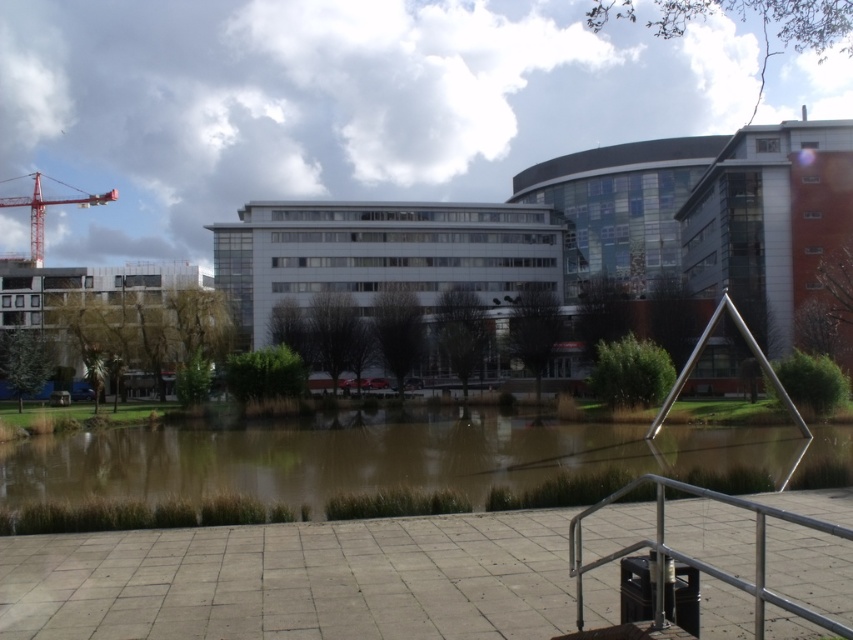
Question: Which point is farther from the camera taking this photo?

Choices:
 (A) (38, 266)
 (B) (204, 490)

Answer: (A)

Question: Does brown muddy water at center have a larger size compared to red metal crane at upper left?

Choices:
 (A) yes
 (B) no

Answer: (B)

Question: Which object is farther from the camera taking this photo?

Choices:
 (A) brown muddy water at center
 (B) silver metallic rail at lower right

Answer: (A)

Question: Can you confirm if brown muddy water at center is positioned to the right of red metal crane at upper left?

Choices:
 (A) no
 (B) yes

Answer: (B)

Question: Can you confirm if silver metallic rail at lower right is bigger than red metal crane at upper left?

Choices:
 (A) no
 (B) yes

Answer: (A)

Question: Which of the following is the closest to the observer?

Choices:
 (A) (524, 460)
 (B) (32, 259)
 (C) (762, 618)

Answer: (C)